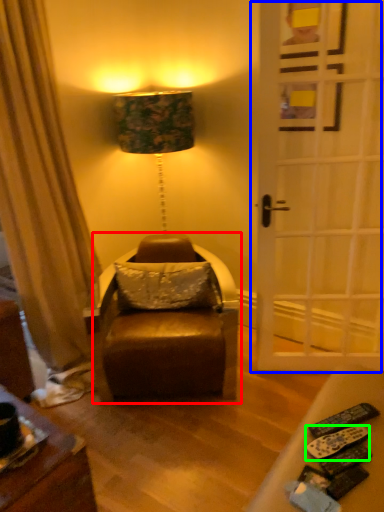
Question: Which object is the farthest from swivel chair (highlighted by a red box)? Choose among these: door (highlighted by a blue box) or remote control (highlighted by a green box).

Choices:
 (A) door
 (B) remote control

Answer: (B)